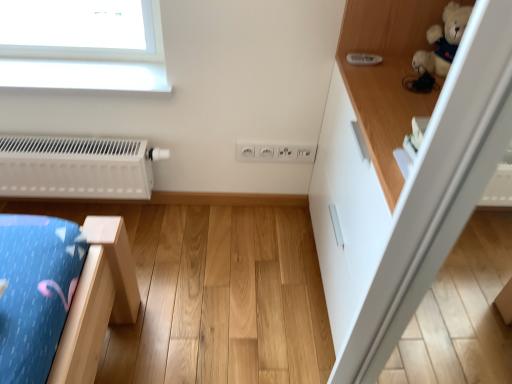
Identify the location of vacant space situated above white matte radiator at left (from a real-world perspective). This screenshot has height=384, width=512. (67, 134).